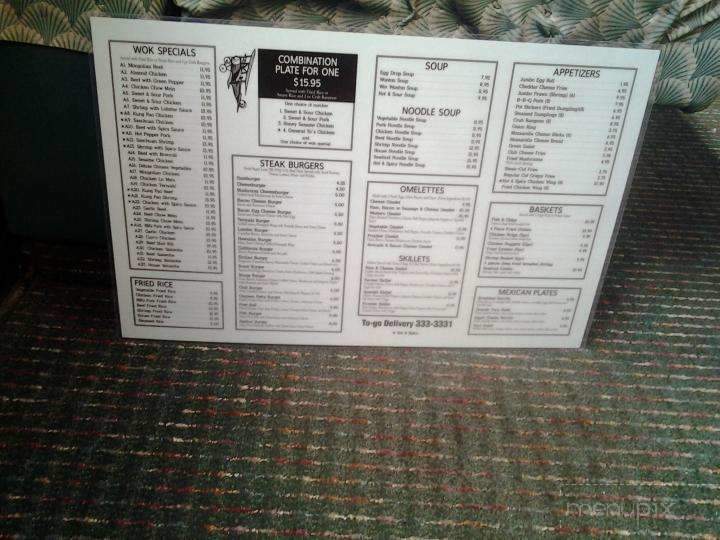
Image resolution: width=720 pixels, height=540 pixels. Identify the location of rug. (534, 445).